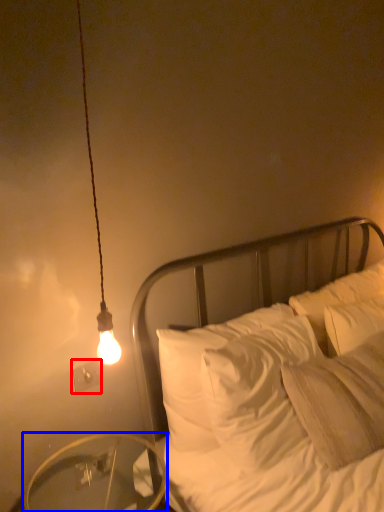
Question: Which point is further to the camera, electric outlet (highlighted by a red box) or table (highlighted by a blue box)?

Choices:
 (A) electric outlet
 (B) table

Answer: (A)